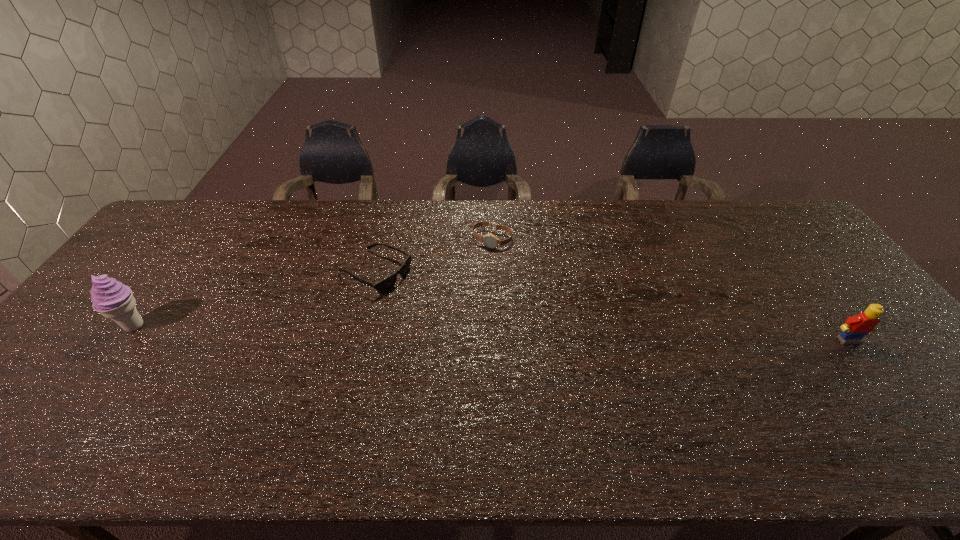
You are a GUI agent. You are given a task and a screenshot of the screen. Output one action in this format:
    pyautogui.click(x=<x>, y=<y>)
    Task: Click on the vacant spot on the desktop that is between the icecream and the Lego and is positioned on the face of the third object from left to right
    
    Given the screenshot: What is the action you would take?
    pyautogui.click(x=442, y=332)

I want to click on free space on the desktop that is between the icecream and the rightmost object and is positioned on the front-facing side of the second object from left to right, so click(498, 333).